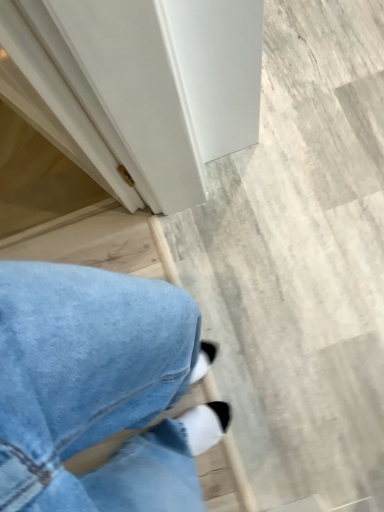
The width and height of the screenshot is (384, 512). What are the coordinates of `white matte stairwell at center` in the screenshot? It's located at (301, 258).

What do you see at coordinates (301, 258) in the screenshot?
I see `white matte stairwell at center` at bounding box center [301, 258].

Where is `white matte stairwell at center`? The image size is (384, 512). white matte stairwell at center is located at coordinates (301, 258).